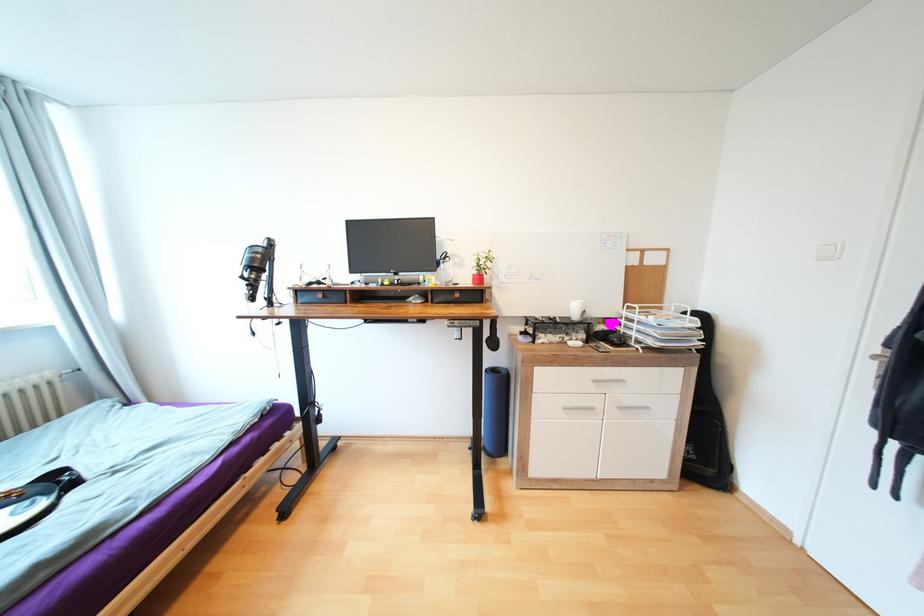
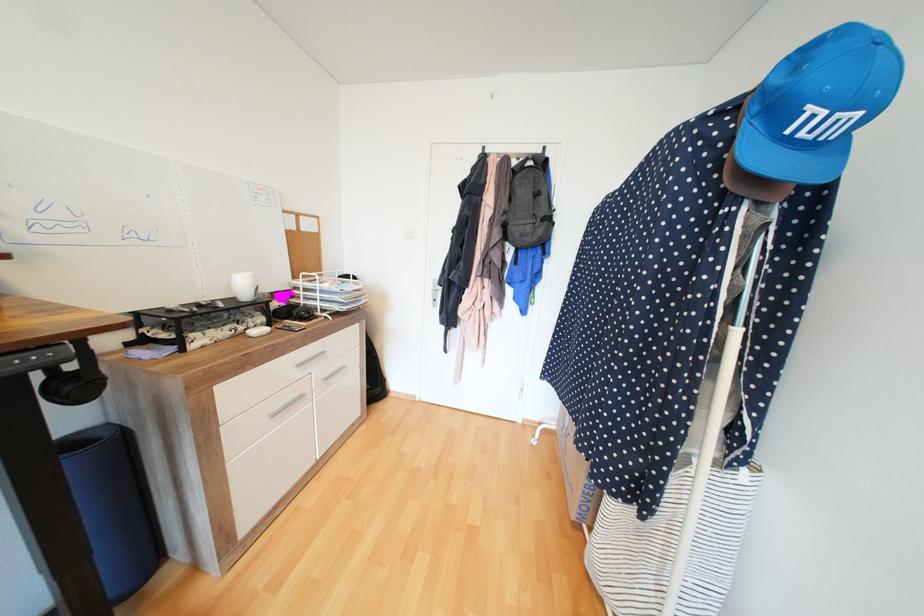
Where in the second image is the point corresponding to pixel 581 317 from the first image?

(251, 296)